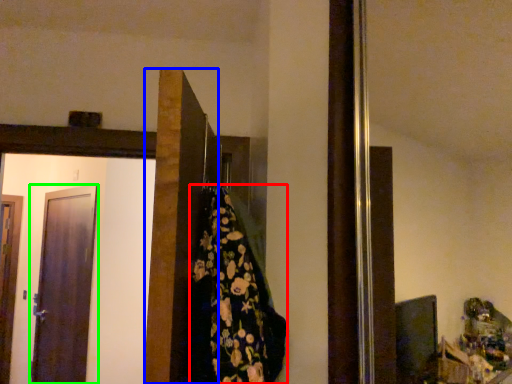
Question: Considering the real-world distances, which object is farthest from blanket (highlighted by a red box)? door (highlighted by a blue box) or door (highlighted by a green box)?

Choices:
 (A) door
 (B) door

Answer: (B)